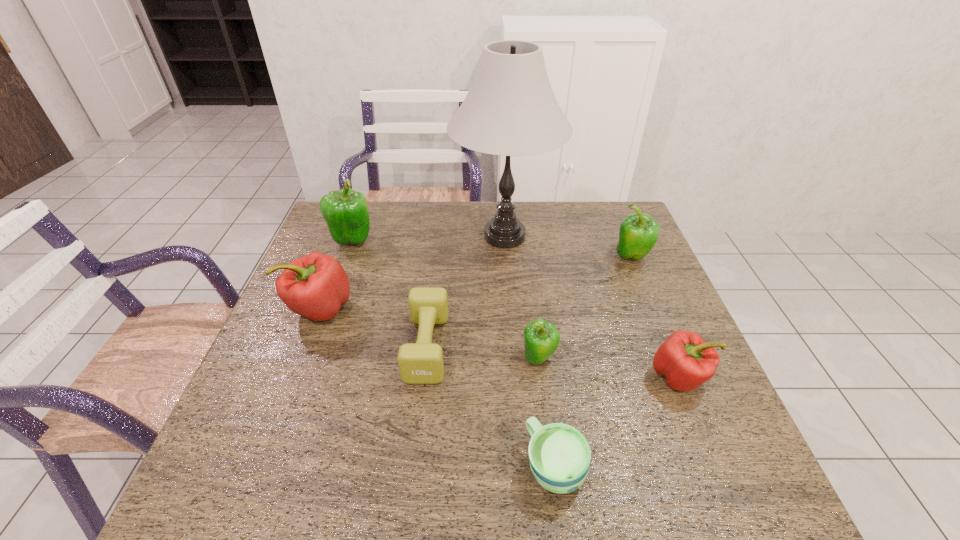
Where is `free space at the far right corner`? free space at the far right corner is located at coordinates (614, 202).

Where is `free space between the olive dumbbell and the second smallest green bell pepper`? The height and width of the screenshot is (540, 960). free space between the olive dumbbell and the second smallest green bell pepper is located at coordinates (529, 301).

The image size is (960, 540). I want to click on unoccupied position between the smallest green bell pepper and the blue cup, so click(x=547, y=411).

The height and width of the screenshot is (540, 960). Identify the location of vacant area between the cup and the smaller pink bell pepper. (617, 421).

At what (x,y) coordinates should I click in order to perform the action: click on free spot between the leftmost green bell pepper and the black lamp. Please return your answer as a coordinate pair (x, y). Image resolution: width=960 pixels, height=540 pixels. Looking at the image, I should click on (428, 238).

Where is `free area in between the rightmost green bell pepper and the tallest object`? The width and height of the screenshot is (960, 540). free area in between the rightmost green bell pepper and the tallest object is located at coordinates pyautogui.click(x=568, y=246).

Find the location of a particular element. vacant area that lies between the nearer pink bell pepper and the tallest object is located at coordinates (592, 306).

Where is `empty space between the lamp and the right pink bell pepper`? The width and height of the screenshot is (960, 540). empty space between the lamp and the right pink bell pepper is located at coordinates (592, 306).

Locate an element on the screen. blank region between the lamp and the second smallest green bell pepper is located at coordinates (568, 246).

What are the coordinates of `free spot between the lamp and the bigger pink bell pepper` in the screenshot? It's located at (413, 272).